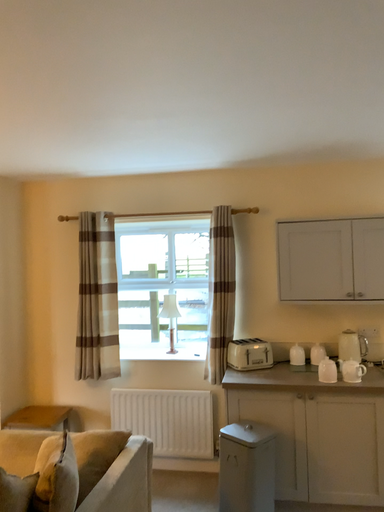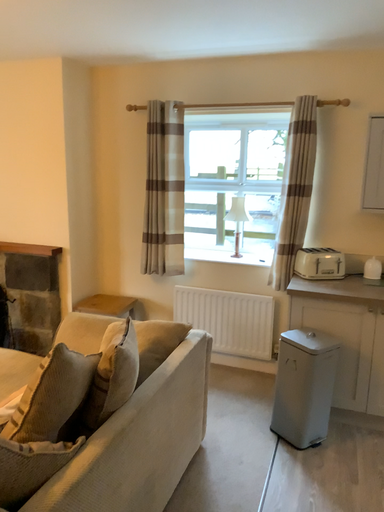
Question: Which way did the camera rotate in the video?

Choices:
 (A) rotated left
 (B) rotated right

Answer: (A)